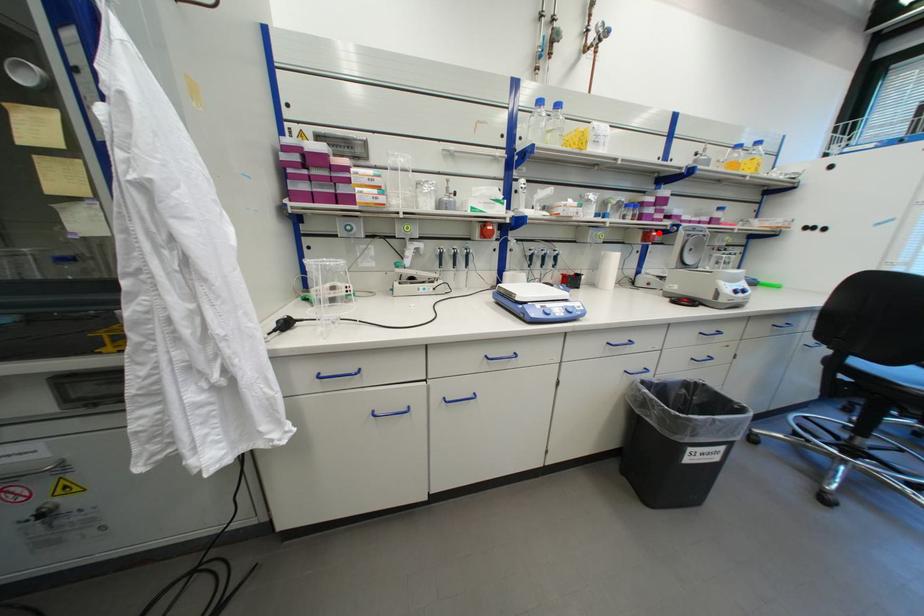
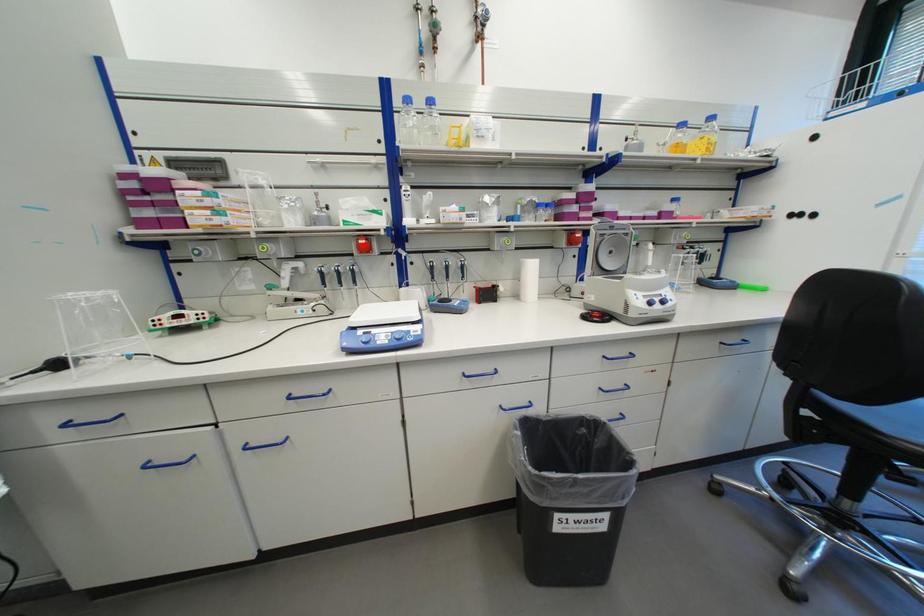
I am providing you with two images of the same scene from different viewpoints. A red point is marked on the first image and another point is marked on the second image. Do the highlighted points in image1 and image2 indicate the same real-world spot?

No